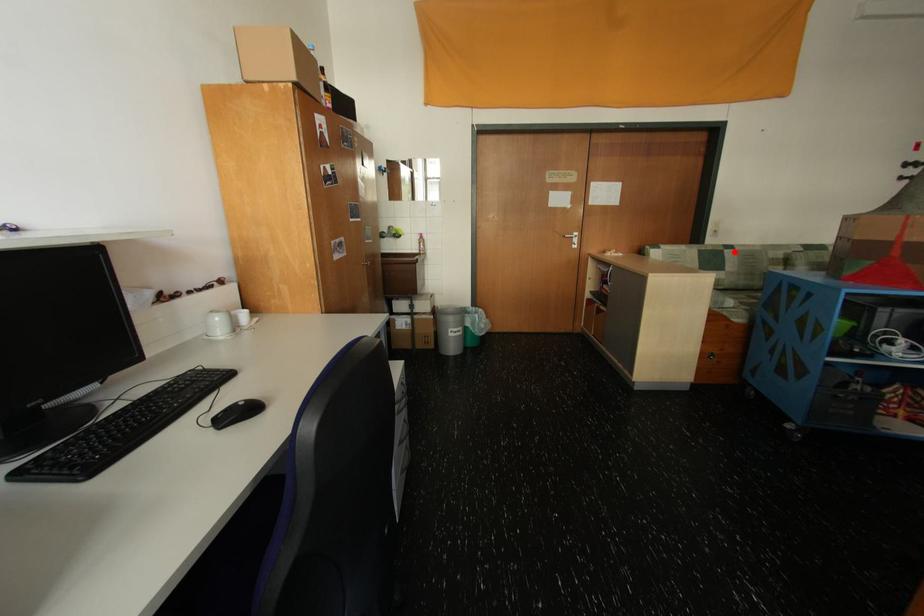
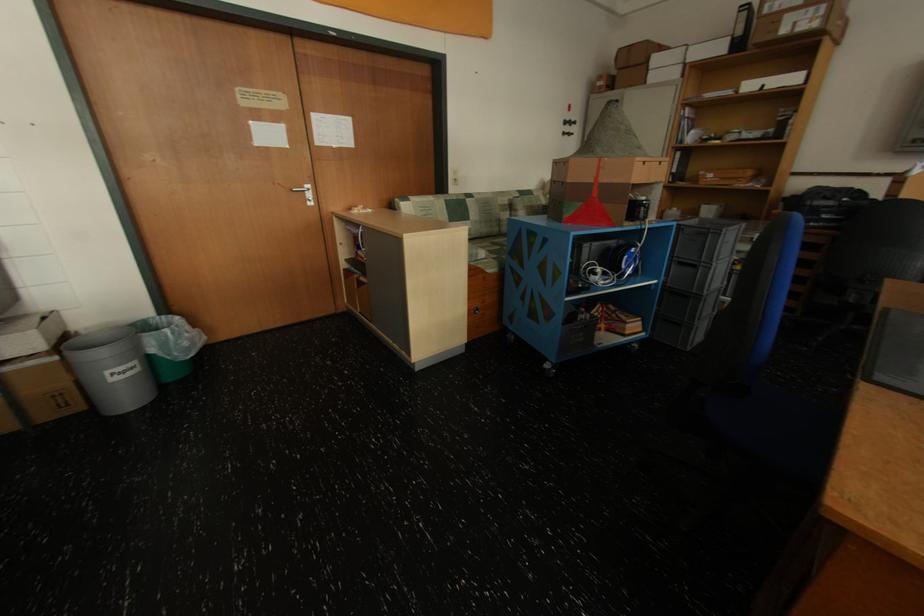
Question: I am providing you with two images of the same scene from different viewpoints. A red point is marked on the first image. Is the red point's position out of view in image 2?

Choices:
 (A) Yes
 (B) No

Answer: (B)